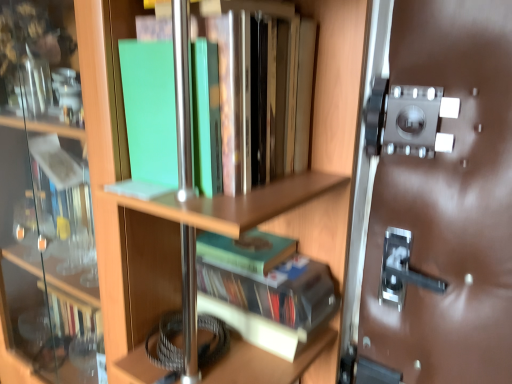
The width and height of the screenshot is (512, 384). What are the coordinates of `vacant space situated above green matte book at center, which is the 1th book from bottom to top (from a real-world perspective)` in the screenshot? It's located at (289, 267).